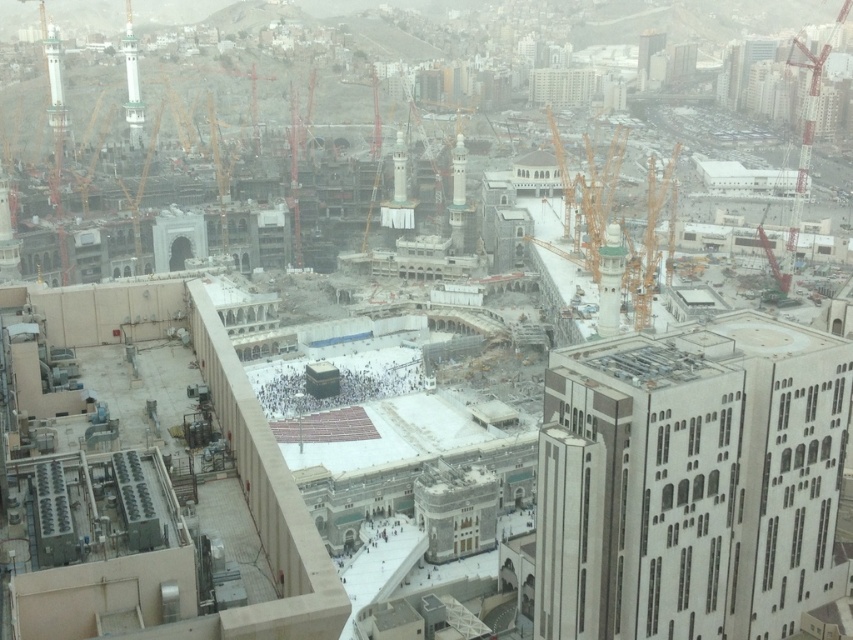
Consider the image. You are standing at the entrance of the modern building with air conditioning units on its rooftop. Looking towards the central plaza, where is the metallic yellow crane at center located in relation to your position? Please provide coordinates in the format of a point with two decimal places.

The metallic yellow crane at center is located at point coordinates of (587, 196) relative to your position.

You are a construction supervisor who needs to move a large beam between the metallic yellow crane at center and the red metal crane at right. The beam is 50 meters long. Can you safely pass the beam between them without bending or cutting it?

The metallic yellow crane at center and red metal crane at right are 54.59 meters apart, so yes, the beam can be safely passed between them as the distance is greater than the beam length of 50 meters.

You are a city planner assessing the construction site. You need to determine if the metallic yellow crane at center can be moved to the area where the red metal crane at right is currently located. Based on their sizes, is this feasible?

The metallic yellow crane at center occupies less space than the red metal crane at right. Therefore, moving the metallic yellow crane at center to the area currently occupied by the red metal crane at right is feasible since it requires less space.